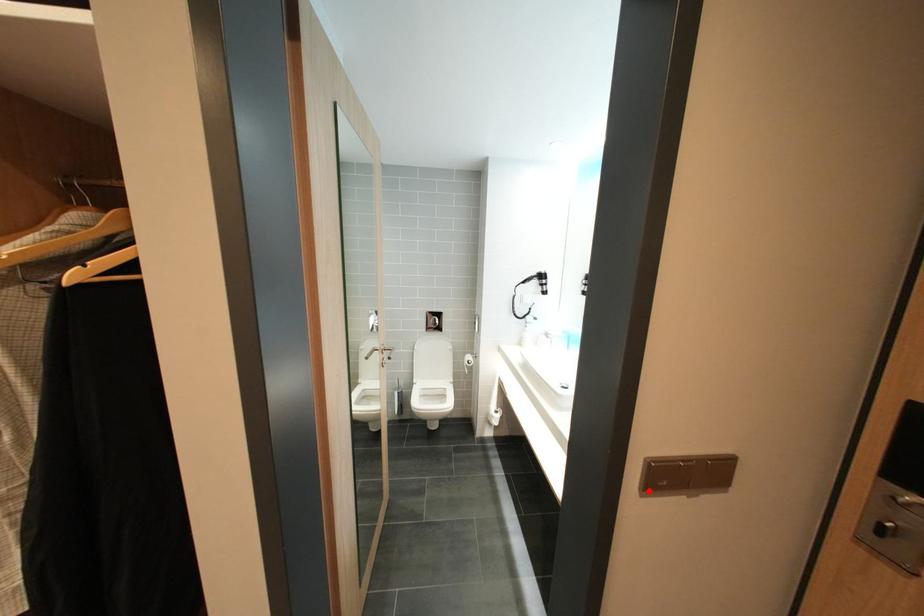
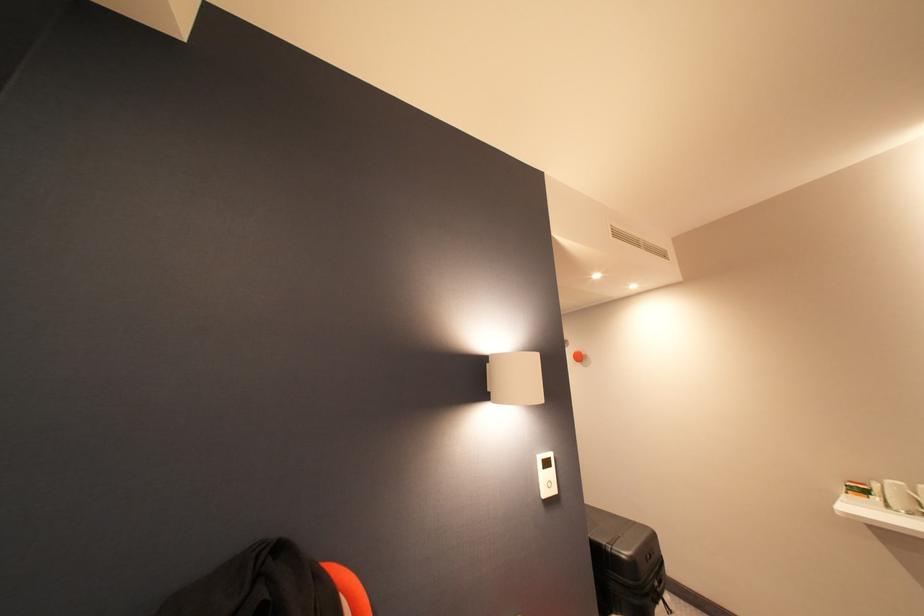
Question: I am providing you with two images of the same scene from different viewpoints. A red point is marked on the first image. At the location where the point appears in image 1, is it still visible in image 2?

Choices:
 (A) Yes
 (B) No

Answer: (B)